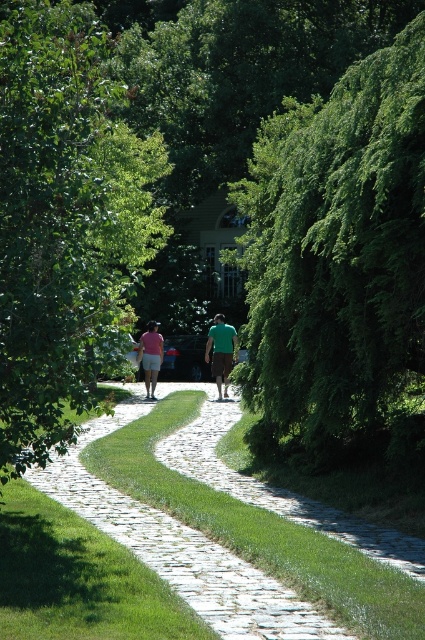
Question: Estimate the real-world distances between objects in this image. Which object is closer to the green matte shirt at center?

Choices:
 (A) matte pink shorts at center
 (B) white cobblestone path at center
 (C) pink cotton shorts at center

Answer: (A)

Question: Does white cobblestone path at center have a lesser width compared to matte pink shorts at center?

Choices:
 (A) no
 (B) yes

Answer: (A)

Question: Which object appears closest to the camera in this image?

Choices:
 (A) green leafy tree at left
 (B) white cobblestone path at center
 (C) matte pink shorts at center
 (D) pink cotton shorts at center

Answer: (B)

Question: Can you confirm if green leafy tree at center is positioned to the right of green leafy tree at left?

Choices:
 (A) yes
 (B) no

Answer: (A)

Question: Based on their relative distances, which object is nearer to the pink cotton shorts at center?

Choices:
 (A) green leafy tree at left
 (B) matte pink shorts at center

Answer: (B)

Question: Does matte pink shorts at center appear on the right side of pink cotton shorts at center?

Choices:
 (A) no
 (B) yes

Answer: (B)